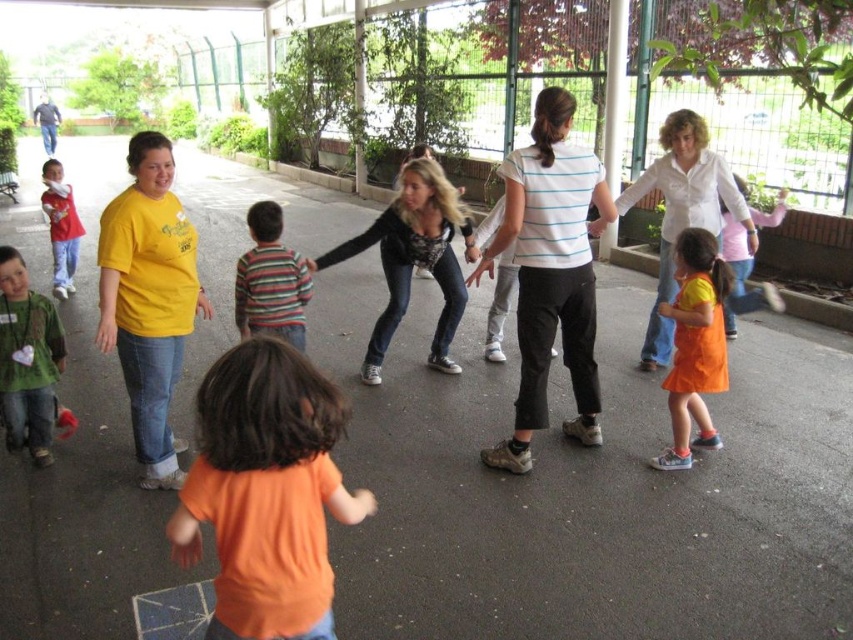
Question: Does white shirt at center lie in front of orange matte dress at lower right?

Choices:
 (A) yes
 (B) no

Answer: (A)

Question: Which object is the closest to the yellow t-shirt at center?

Choices:
 (A) white shirt at center
 (B) green matte shirt at left
 (C) white striped shirt at center

Answer: (B)

Question: Among these points, which one is nearest to the camera?

Choices:
 (A) (51, 244)
 (B) (675, 228)
 (C) (480, 260)
 (D) (144, 164)

Answer: (D)

Question: Is white shirt at center thinner than striped cotton shirt at center?

Choices:
 (A) no
 (B) yes

Answer: (A)

Question: Does striped cotton shirt at center have a greater width compared to matte red shirt at left?

Choices:
 (A) yes
 (B) no

Answer: (A)

Question: Estimate the real-world distances between objects in this image. Which object is farther from the leather jacket at center?

Choices:
 (A) green matte shirt at left
 (B) striped cotton shirt at center
 (C) white striped shirt at center

Answer: (A)